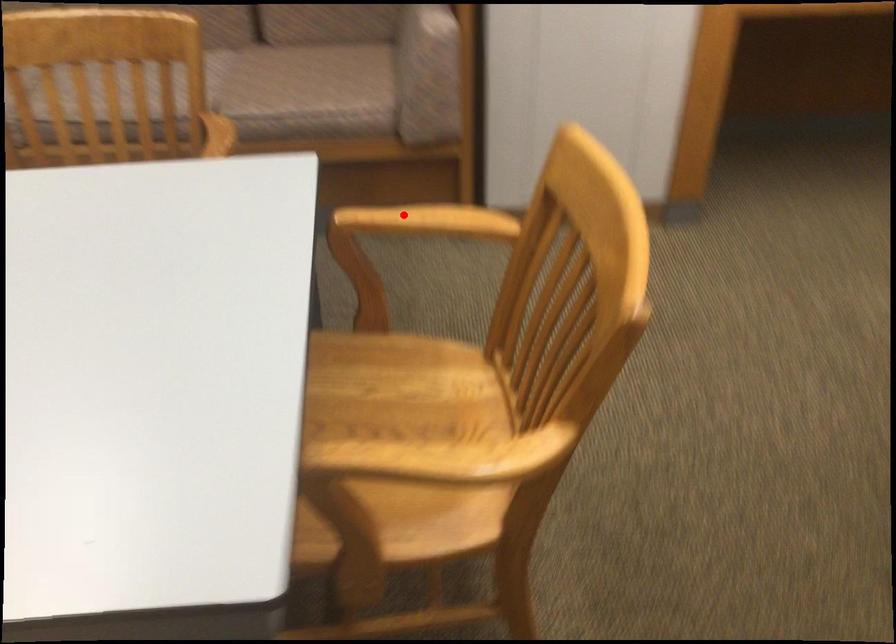
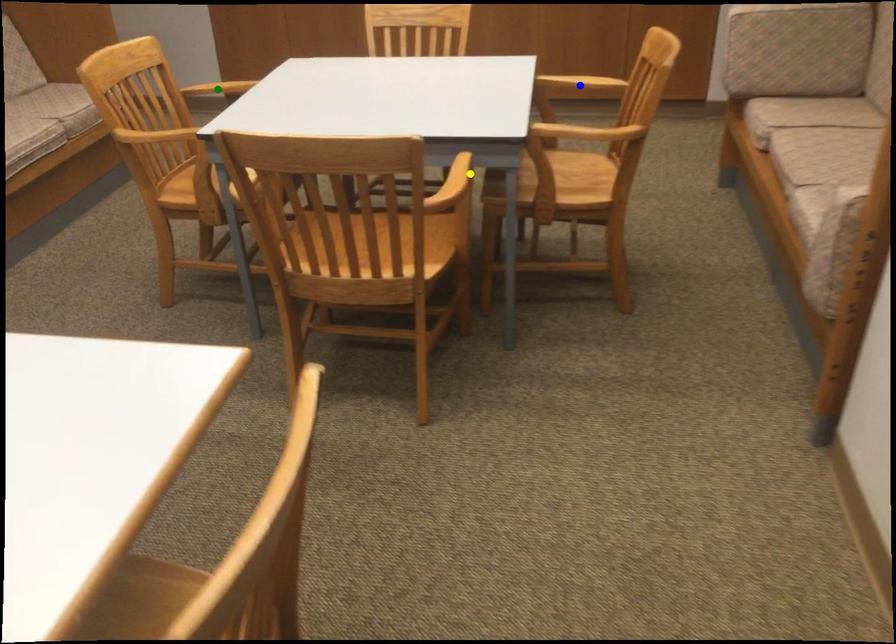
Question: I am providing you with two images of the same scene from different viewpoints. A red point is marked on the first image. You are given multiple points on the second image. Which spot in image 2 lines up with the point in image 1?

Choices:
 (A) yellow point
 (B) green point
 (C) blue point

Answer: (A)